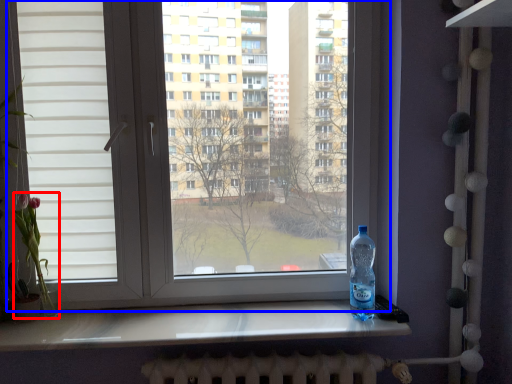
Question: Which of the following is the closest to the observer, flower (highlighted by a red box) or window (highlighted by a blue box)?

Choices:
 (A) flower
 (B) window

Answer: (B)